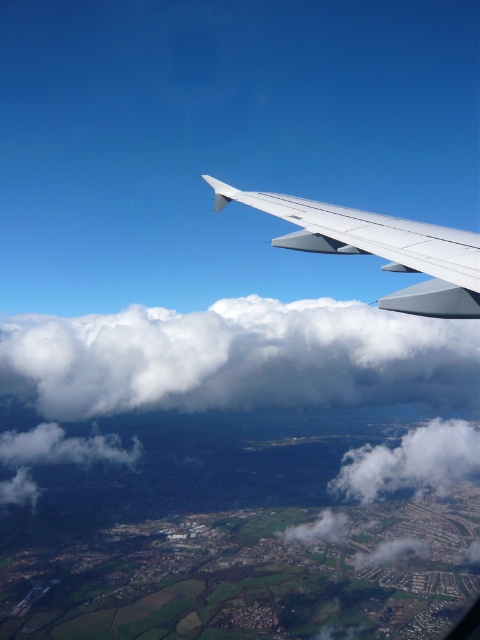
From the picture: You are a pilot looking out of the airplane window and see the white fluffy cloud at upper center and the white matte wing at upper center. Which object is located more to the right side?

The white fluffy cloud at upper center is positioned on the right side of the white matte wing at upper center, so the white fluffy cloud at upper center is more to the right side.

You are a pilot looking out of the airplane window and see two clouds, the white fluffy cloud at upper center and the white fluffy cloud at lower right. Which cloud appears wider from your current view?

The white fluffy cloud at upper center appears wider because its width is larger than the white fluffy cloud at lower right.